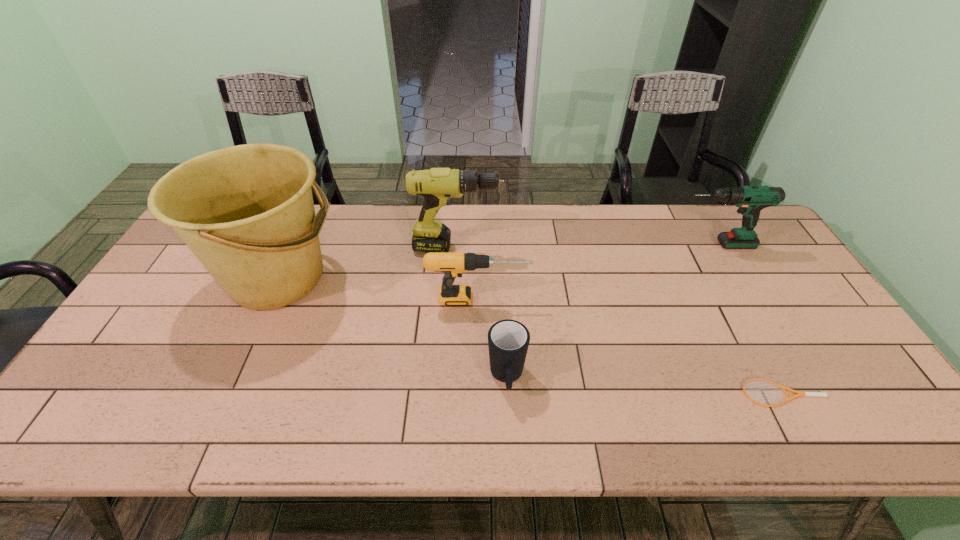
At what (x,y) coordinates should I click in order to perform the action: click on free space between the shortest object and the second tallest object. Please return your answer as a coordinate pair (x, y). Looking at the image, I should click on (620, 320).

You are a GUI agent. You are given a task and a screenshot of the screen. Output one action in this format:
    pyautogui.click(x=<x>, y=<y>)
    Task: Click on the vacant region between the fifth tallest object and the tennis racket
    
    Given the screenshot: What is the action you would take?
    pyautogui.click(x=645, y=386)

The image size is (960, 540). I want to click on free area in between the tennis racket and the shortest drill, so click(x=631, y=346).

Where is `vacant region between the fifth shortest object and the shortest object`? vacant region between the fifth shortest object and the shortest object is located at coordinates (620, 320).

The width and height of the screenshot is (960, 540). Find the location of `free area in between the shortest object and the tallest object`. free area in between the shortest object and the tallest object is located at coordinates (531, 335).

Identify the location of free point between the fifth shortest object and the mug. coord(482,313).

In order to click on free space between the third tallest object and the mug in this screenshot , I will do `click(611, 312)`.

You are a GUI agent. You are given a task and a screenshot of the screen. Output one action in this format:
    pyautogui.click(x=<x>, y=<y>)
    Task: Click on the empty space between the nearest drill and the tallest object
    This screenshot has width=960, height=540.
    Given the screenshot: What is the action you would take?
    pyautogui.click(x=378, y=288)

Locate an element on the screen. This screenshot has width=960, height=540. vacant space that's between the fifth shortest object and the third tallest object is located at coordinates (x=587, y=246).

Identify which object is located as the second nearest to the rightmost drill. Please provide its 2D coordinates. Your answer should be formatted as a tuple, i.e. [(x, y)], where the tuple contains the x and y coordinates of a point satisfying the conditions above.

[(453, 264)]